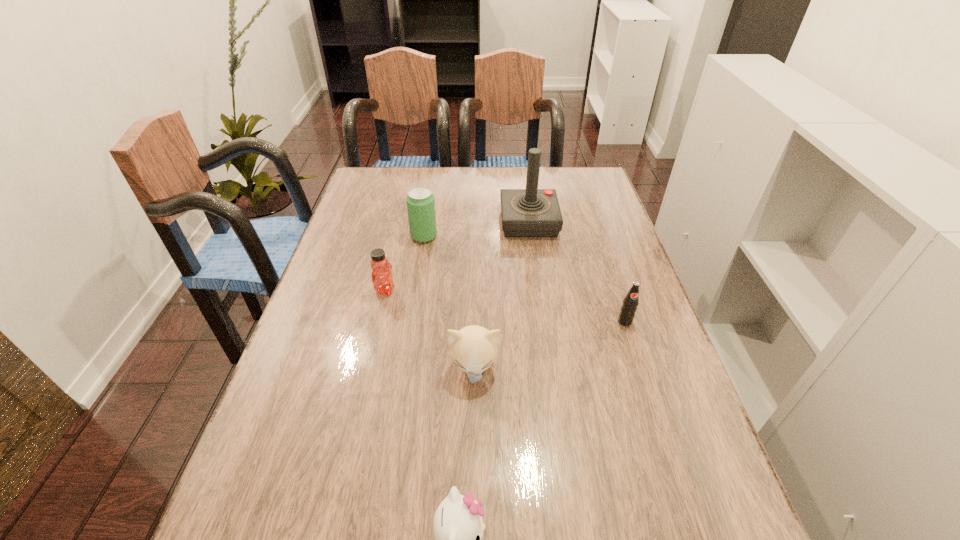
You are a GUI agent. You are given a task and a screenshot of the screen. Output one action in this format:
    pyautogui.click(x=<x>, y=<y>)
    Task: Click on the vacant space located 0.320m on the rectangular base of the fifth object from left to right
    
    Given the screenshot: What is the action you would take?
    pyautogui.click(x=400, y=222)

Where is `free space located on the rectangular base of the fifth object from left to right`? free space located on the rectangular base of the fifth object from left to right is located at coordinates (438, 222).

Identify the location of vacant point located 0.130m on the front of the left pop. (419, 273).

Identify the location of free space located 0.210m on the face of the second nearest object. (472, 489).

Image resolution: width=960 pixels, height=540 pixels. I want to click on free space located 0.080m on the front label of the third farthest object, so click(426, 290).

Where is `free space located on the front label of the rightmost object`? This screenshot has width=960, height=540. free space located on the front label of the rightmost object is located at coordinates (636, 353).

Where is `object at the left edge`? This screenshot has height=540, width=960. object at the left edge is located at coordinates pos(382,279).

Locate an element on the screen. This screenshot has width=960, height=540. object that is at the right edge is located at coordinates (630, 302).

Identify the location of free location at the far edge. Image resolution: width=960 pixels, height=540 pixels. (454, 168).

At what (x,y) coordinates should I click in order to perform the action: click on free region at the left edge of the desktop. Please return your answer as a coordinate pair (x, y). Looking at the image, I should click on (238, 509).